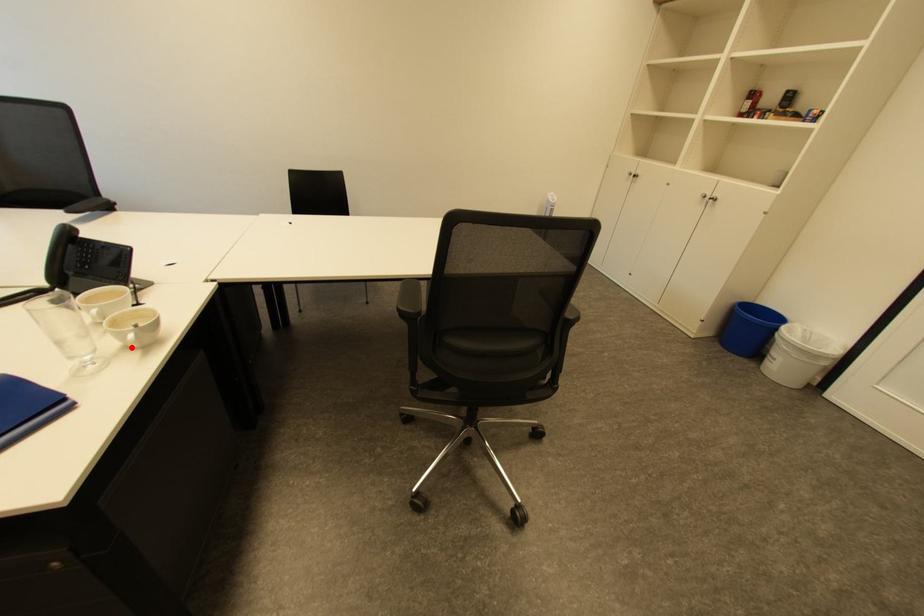
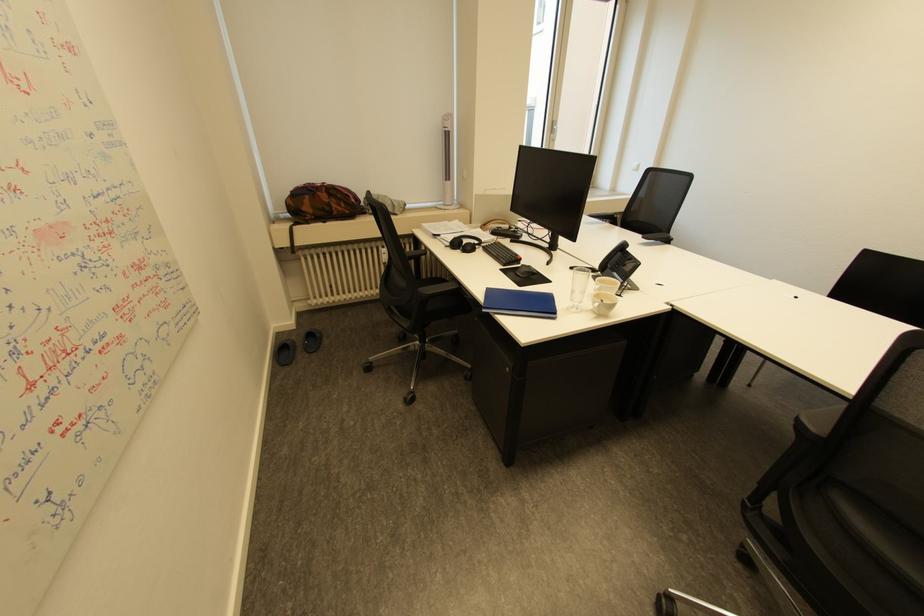
Where in the second image is the point corresponding to the highlighted location from the first image?

(600, 310)